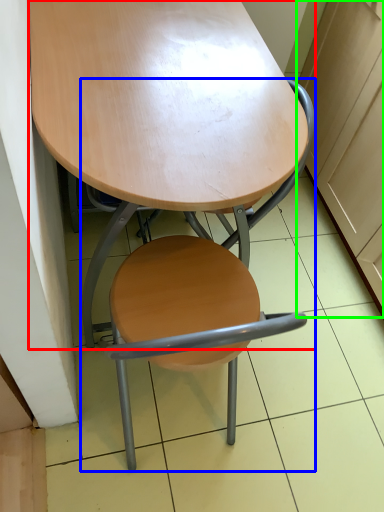
Question: Which object is positioned closest to table (highlighted by a red box)? Select from chair (highlighted by a blue box) and cabinetry (highlighted by a green box).

Choices:
 (A) chair
 (B) cabinetry

Answer: (A)